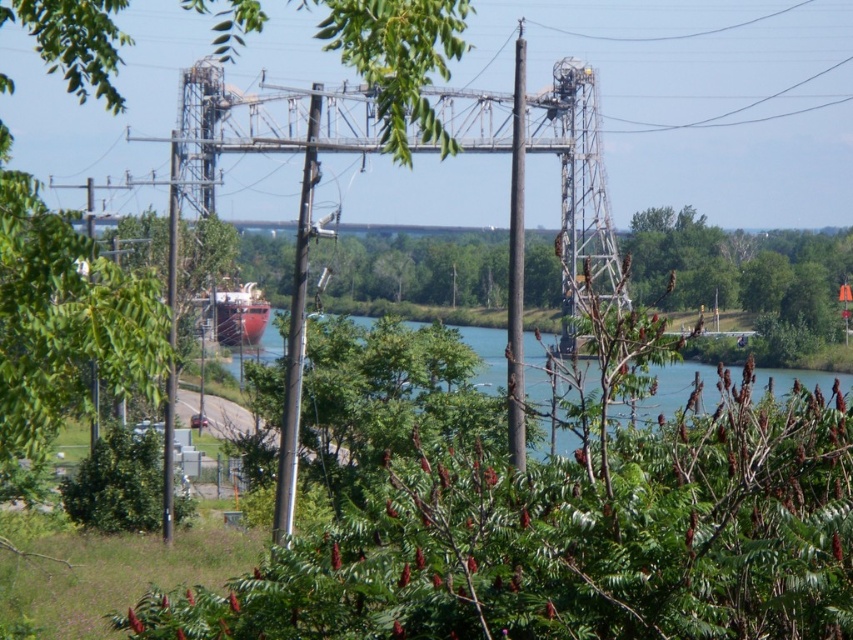
Question: Can you confirm if smooth metallic pole at center is smaller than metallic gray pole at left?

Choices:
 (A) no
 (B) yes

Answer: (B)

Question: Among these points, which one is farthest from the camera?

Choices:
 (A) (173, 234)
 (B) (682, 365)

Answer: (B)

Question: Is smooth metallic pole at center closer to camera compared to shiny red ship at center?

Choices:
 (A) yes
 (B) no

Answer: (A)

Question: Does green water at center have a lesser width compared to brown wood pole at center?

Choices:
 (A) yes
 (B) no

Answer: (B)

Question: Among these objects, which one is nearest to the camera?

Choices:
 (A) green water at center
 (B) brown wood pole at center
 (C) metallic gray pole at left

Answer: (C)

Question: Which of these objects is positioned closest to the smooth metallic pole at center?

Choices:
 (A) brown wood pole at center
 (B) green water at center
 (C) metallic gray pole at left

Answer: (C)